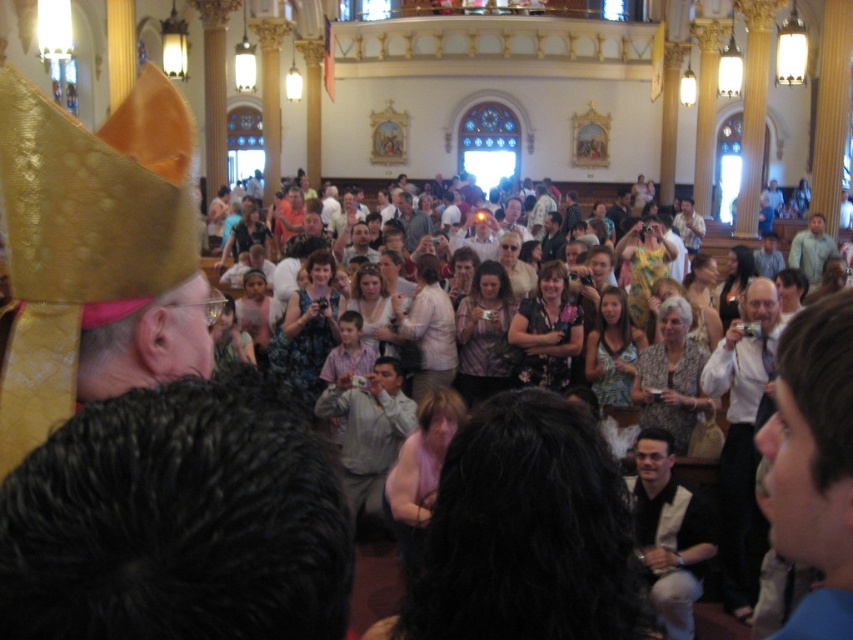
You are standing at the entrance of the hall and see the blue shirt at lower right and the white shirt at center. If you want to take a photo that includes both people, which direction should you move to ensure they are both in the frame?

You should move towards the blue shirt at lower right because it is farther away from the white shirt at center, so moving closer to it would help include both in the frame.

You are standing in the grand hall and notice a person wearing a blue shirt at lower right. Where exactly is this person positioned in relation to the large windows and hanging lamps?

The blue shirt at lower right is located at point coordinates of 0.725 on the x axis and 0.954 on the y axis, which places it near the lower right corner of the image, close to the large windows and under one of the hanging lamps.